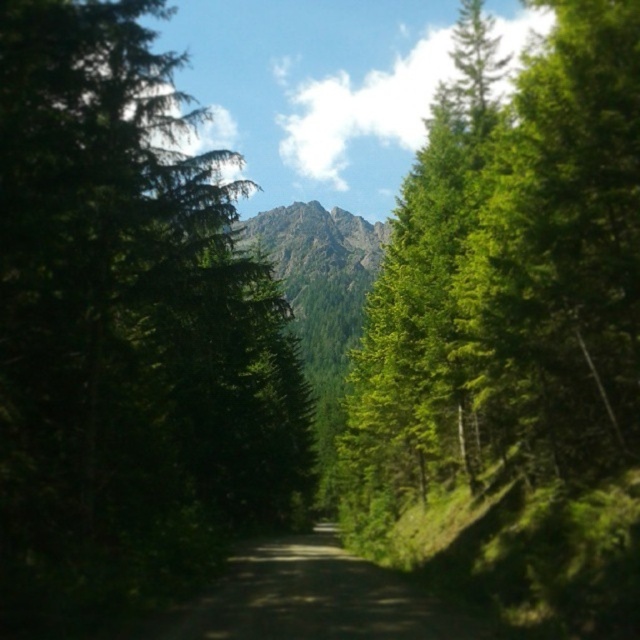
Question: Observing the image, what is the correct spatial positioning of green matte tree at left in reference to dirt road at center?

Choices:
 (A) below
 (B) above

Answer: (B)

Question: Estimate the real-world distances between objects in this image. Which object is closer to the dirt road at center?

Choices:
 (A) green leafy tree at center
 (B) green matte tree at left

Answer: (B)

Question: Which of the following is the farthest from the observer?

Choices:
 (A) dirt road at center
 (B) green leafy tree at center
 (C) green matte tree at left

Answer: (B)

Question: Considering the relative positions of green matte tree at left and dirt road at center in the image provided, where is green matte tree at left located with respect to dirt road at center?

Choices:
 (A) above
 (B) below

Answer: (A)

Question: Which object is the farthest from the dirt road at center?

Choices:
 (A) green matte tree at left
 (B) green leafy tree at center

Answer: (B)

Question: Can you confirm if green matte tree at left is wider than green leafy tree at center?

Choices:
 (A) no
 (B) yes

Answer: (B)